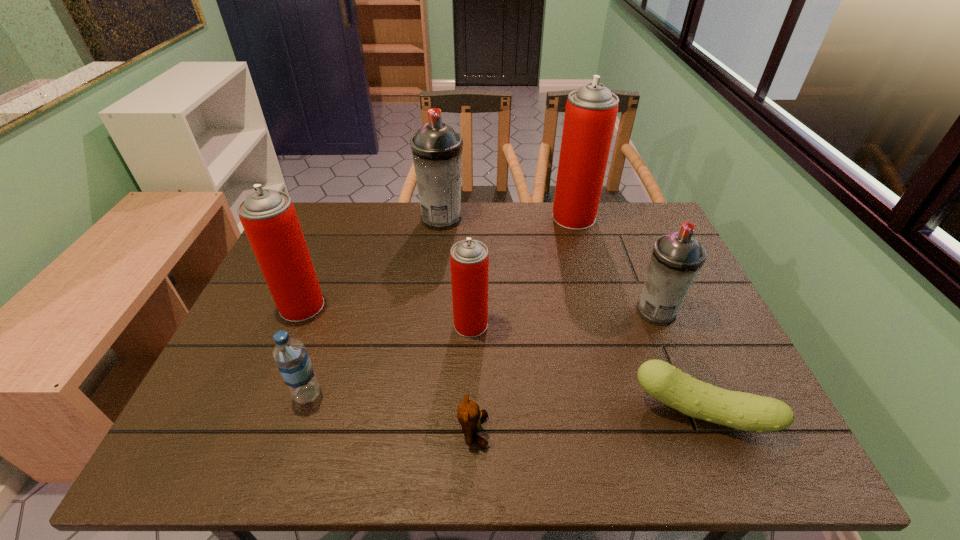
Locate an element on the screen. The width and height of the screenshot is (960, 540). free space that satisfies the following two spatial constraints: 1. on the front side of the second smallest red aerosol can; 2. on the left side of the green cucumber is located at coordinates (258, 412).